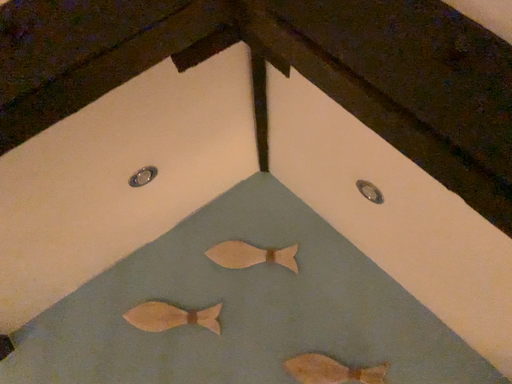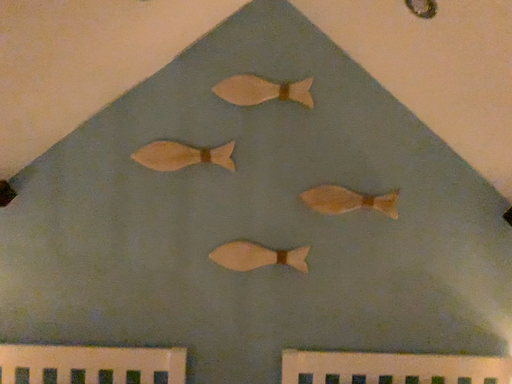
Question: How did the camera likely rotate when shooting the video?

Choices:
 (A) rotated upward
 (B) rotated downward

Answer: (B)